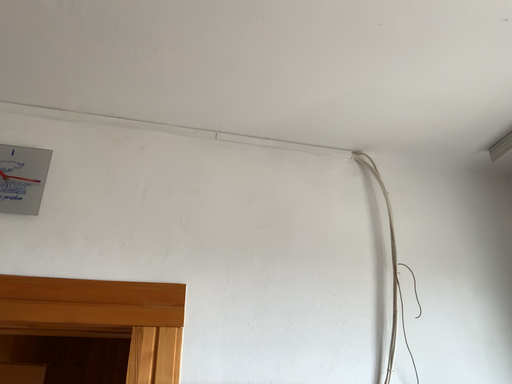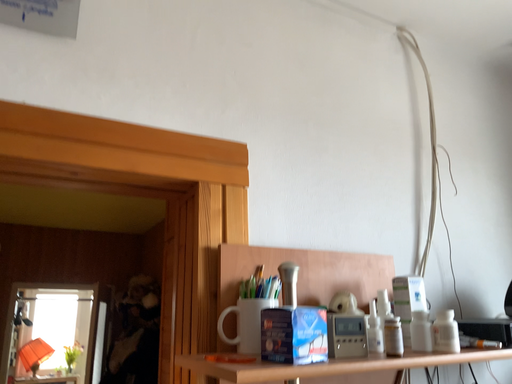
Question: Which way did the camera rotate in the video?

Choices:
 (A) rotated right
 (B) rotated left

Answer: (A)